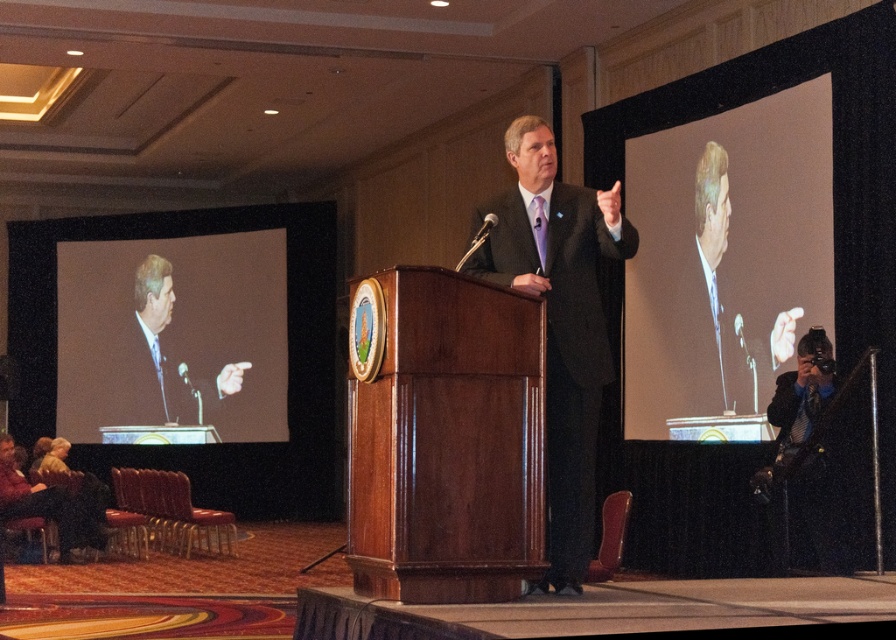
Question: Which point is farther to the camera?

Choices:
 (A) (147, 276)
 (B) (56, 504)
 (C) (200, 422)
 (D) (696, 200)

Answer: (A)

Question: Where is dark gray suit at center located in relation to matte black suit at left in the image?

Choices:
 (A) left
 (B) right

Answer: (B)

Question: Based on their relative distances, which object is farther from the matte black suit at left?

Choices:
 (A) matte black screen at upper right
 (B) dark gray suit at center
 (C) leather jacket at lower left

Answer: (B)

Question: Can you confirm if leather jacket at lower left is bigger than matte black suit at center?

Choices:
 (A) no
 (B) yes

Answer: (B)

Question: Can you confirm if matte black screen at upper right is bigger than leather jacket at lower left?

Choices:
 (A) no
 (B) yes

Answer: (B)

Question: Among these objects, which one is farthest from the camera?

Choices:
 (A) smooth blue suit at upper right
 (B) matte black suit at center
 (C) matte black screen at upper right

Answer: (B)